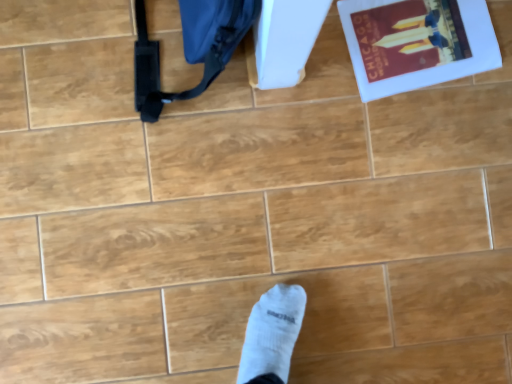
Question: Is matte paper book at upper right situated inside matte blue messenger bag at upper left or outside?

Choices:
 (A) inside
 (B) outside

Answer: (B)

Question: From a real-world perspective, is matte paper book at upper right above or below matte blue messenger bag at upper left?

Choices:
 (A) above
 (B) below

Answer: (B)

Question: In terms of size, does matte paper book at upper right appear bigger or smaller than matte blue messenger bag at upper left?

Choices:
 (A) big
 (B) small

Answer: (B)

Question: Does point 153,81 appear closer or farther from the camera than point 382,44?

Choices:
 (A) closer
 (B) farther

Answer: (A)

Question: From a real-world perspective, is matte blue messenger bag at upper left positioned above or below matte paper book at upper right?

Choices:
 (A) above
 (B) below

Answer: (A)

Question: Considering the positions of matte blue messenger bag at upper left and matte paper book at upper right in the image, is matte blue messenger bag at upper left wider or thinner than matte paper book at upper right?

Choices:
 (A) wide
 (B) thin

Answer: (B)

Question: From the image's perspective, is matte blue messenger bag at upper left located above or below matte paper book at upper right?

Choices:
 (A) above
 (B) below

Answer: (B)